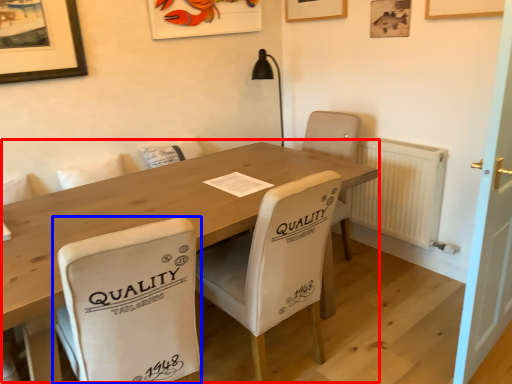
Question: Which point is further to the camera, table (highlighted by a red box) or chair (highlighted by a blue box)?

Choices:
 (A) table
 (B) chair

Answer: (A)